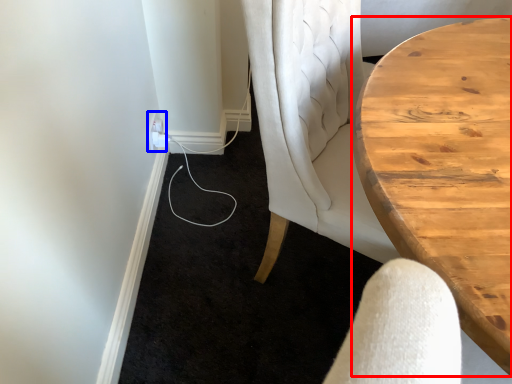
Question: Which object is closer to the camera taking this photo, table (highlighted by a red box) or electric outlet (highlighted by a blue box)?

Choices:
 (A) table
 (B) electric outlet

Answer: (A)